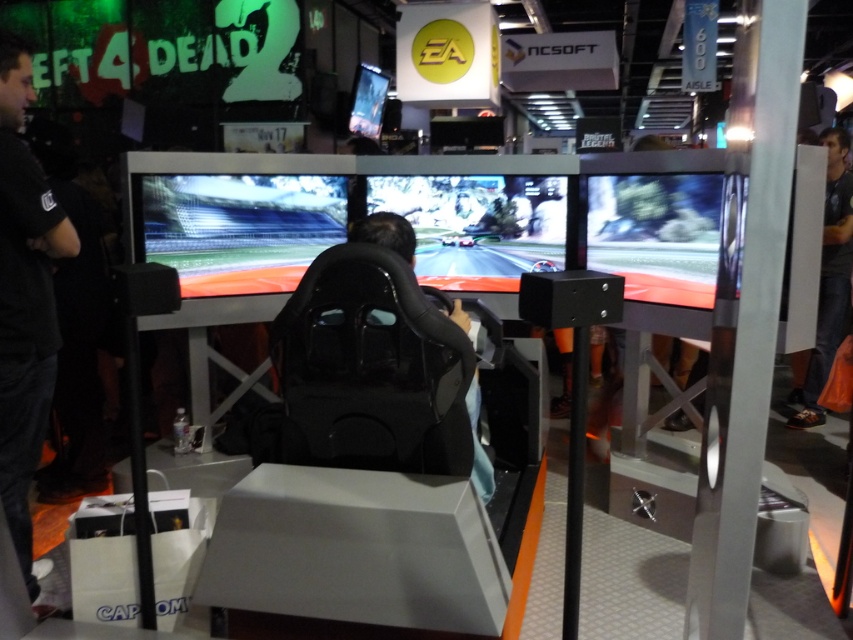
You are a photographer at the expo and want to take a photo of the black fabric shirt at left and the black leather chair at center. Which object should you focus on first if you want to capture both in focus without moving the camera?

You should focus on the black leather chair at center first because it is behind the black fabric shirt at left, so adjusting focus for the chair will also keep the shirt in focus.

You are a photographer at the expo and need to capture a clear photo of the black leather chair at center without the black fabric shirt at left blocking it. How can you adjust your position to achieve this?

The black fabric shirt at left is positioned over the black leather chair at center. To avoid the shirt blocking the chair, move to a position where you can see the chair from below or shift your angle so the shirt is no longer in front of the chair.

You are a convention attendee who wants to sit in the black leather chair at center to try the racing simulator. However, there is a dark gray fabric at right in the way. Can you walk around it to reach the chair?

The black leather chair at center is behind the dark gray fabric at right, so you can walk around the dark gray fabric at right to reach the chair.